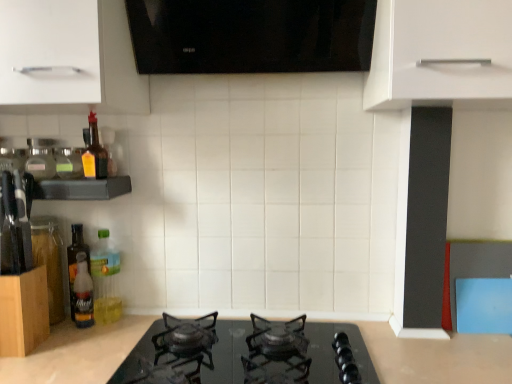
Question: From a real-world perspective, is translucent yellow bottle at left, positioned as the third bottle in left-to-right order, physically located above or below translucent plastic bottle at left, arranged as the 3th bottle when viewed from the right?

Choices:
 (A) above
 (B) below

Answer: (A)

Question: From their relative heights in the image, would you say translucent yellow bottle at left, positioned as the third bottle in left-to-right order, is taller or shorter than translucent plastic bottle at left, the 4th bottle viewed from the left?

Choices:
 (A) tall
 (B) short

Answer: (B)

Question: Which object is positioned closest to the white matte cabinet handle at upper left, which is counted as the first cabinetry, starting from the top?

Choices:
 (A) translucent plastic bottle at left, the 4th bottle viewed from the left
 (B) translucent glass bottle at left, placed as the fifth bottle when sorted from right to left
 (C) translucent yellow bottle at left, the 4th bottle viewed from the right
 (D) clear plastic shelf at left
 (E) translucent amber glass bottle at left, positioned as the 5th bottle in left-to-right order

Answer: (E)

Question: Which of these objects is positioned farthest from the clear glass jar at left, the 1th bottle from the left?

Choices:
 (A) white matte cabinet handle at upper left, which is counted as the first cabinetry, starting from the top
 (B) translucent plastic bottle at left, the 4th bottle viewed from the left
 (C) black glass cooktop at center
 (D) clear plastic shelf at left
 (E) translucent plastic bottle at left, arranged as the first bottle when viewed from the right

Answer: (C)